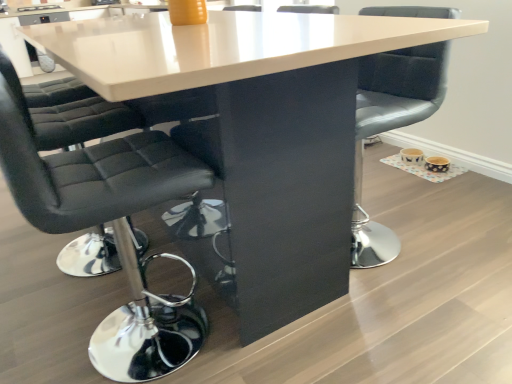
Image resolution: width=512 pixels, height=384 pixels. What do you see at coordinates (391, 127) in the screenshot?
I see `matte gray cushioned chair at center, placed as the second chair when sorted from left to right` at bounding box center [391, 127].

Locate an element on the screen. Image resolution: width=512 pixels, height=384 pixels. matte gray cushioned chair at center, placed as the second chair when sorted from left to right is located at coordinates (391, 127).

You are a GUI agent. You are given a task and a screenshot of the screen. Output one action in this format:
    pyautogui.click(x=<x>, y=<y>)
    Task: Click on the black leather chair at left, the first chair when ordered from left to right
    
    Given the screenshot: What is the action you would take?
    pyautogui.click(x=113, y=227)

This screenshot has width=512, height=384. What do you see at coordinates (113, 227) in the screenshot?
I see `black leather chair at left, positioned as the 2th chair in right-to-left order` at bounding box center [113, 227].

Image resolution: width=512 pixels, height=384 pixels. What are the coordinates of `matte gray cushioned chair at center, placed as the second chair when sorted from left to right` in the screenshot? It's located at (391, 127).

Which is more to the left, black leather chair at left, the first chair when ordered from left to right, or matte gray cushioned chair at center, which appears as the 1th chair when viewed from the right?

Positioned to the left is black leather chair at left, the first chair when ordered from left to right.

Is the depth of black leather chair at left, the first chair when ordered from left to right, greater than that of matte gray cushioned chair at center, which appears as the 1th chair when viewed from the right?

No.

Which is nearer, (183, 347) or (421, 59)?

Clearly, point (183, 347) is closer to the camera than point (421, 59).

From the image's perspective, between black leather chair at left, the first chair when ordered from left to right, and matte gray cushioned chair at center, placed as the second chair when sorted from left to right, who is located below?

black leather chair at left, the first chair when ordered from left to right.

From a real-world perspective, which object stands above the other?

From a 3D spatial view, black leather chair at left, positioned as the 2th chair in right-to-left order, is above.

In terms of width, does black leather chair at left, the first chair when ordered from left to right, look wider or thinner when compared to matte gray cushioned chair at center, placed as the second chair when sorted from left to right?

Clearly, black leather chair at left, the first chair when ordered from left to right, has more width compared to matte gray cushioned chair at center, placed as the second chair when sorted from left to right.

Considering the sizes of black leather chair at left, positioned as the 2th chair in right-to-left order, and matte gray cushioned chair at center, placed as the second chair when sorted from left to right, in the image, is black leather chair at left, positioned as the 2th chair in right-to-left order, taller or shorter than matte gray cushioned chair at center, placed as the second chair when sorted from left to right,?

black leather chair at left, positioned as the 2th chair in right-to-left order, is taller than matte gray cushioned chair at center, placed as the second chair when sorted from left to right.

Based on their sizes in the image, would you say black leather chair at left, positioned as the 2th chair in right-to-left order, is bigger or smaller than matte gray cushioned chair at center, which appears as the 1th chair when viewed from the right?

black leather chair at left, positioned as the 2th chair in right-to-left order, is bigger than matte gray cushioned chair at center, which appears as the 1th chair when viewed from the right.

Would you say black leather chair at left, the first chair when ordered from left to right, contains matte gray cushioned chair at center, placed as the second chair when sorted from left to right?

No, matte gray cushioned chair at center, placed as the second chair when sorted from left to right, is not a part of black leather chair at left, the first chair when ordered from left to right.

Would you say black leather chair at left, positioned as the 2th chair in right-to-left order, is a long distance from matte gray cushioned chair at center, placed as the second chair when sorted from left to right?

No, black leather chair at left, positioned as the 2th chair in right-to-left order, is in close proximity to matte gray cushioned chair at center, placed as the second chair when sorted from left to right.

Is black leather chair at left, the first chair when ordered from left to right, oriented away from matte gray cushioned chair at center, which appears as the 1th chair when viewed from the right?

black leather chair at left, the first chair when ordered from left to right, does not have its back to matte gray cushioned chair at center, which appears as the 1th chair when viewed from the right.

How much distance is there between black leather chair at left, the first chair when ordered from left to right, and matte gray cushioned chair at center, which appears as the 1th chair when viewed from the right?

black leather chair at left, the first chair when ordered from left to right, is 30.98 inches from matte gray cushioned chair at center, which appears as the 1th chair when viewed from the right.

Find the location of a particular element. chair that appears below the matte gray cushioned chair at center, which appears as the 1th chair when viewed from the right (from the image's perspective) is located at coordinates (113, 227).

Considering the relative positions of matte gray cushioned chair at center, placed as the second chair when sorted from left to right, and black leather chair at left, positioned as the 2th chair in right-to-left order, in the image provided, is matte gray cushioned chair at center, placed as the second chair when sorted from left to right, to the right of black leather chair at left, positioned as the 2th chair in right-to-left order, from the viewer's perspective?

Correct, you'll find matte gray cushioned chair at center, placed as the second chair when sorted from left to right, to the right of black leather chair at left, positioned as the 2th chair in right-to-left order.

Which object is further away from the camera, matte gray cushioned chair at center, which appears as the 1th chair when viewed from the right, or black leather chair at left, positioned as the 2th chair in right-to-left order?

matte gray cushioned chair at center, which appears as the 1th chair when viewed from the right, is behind.

Is point (366, 247) farther from camera compared to point (28, 197)?

Yes.

From the image's perspective, is matte gray cushioned chair at center, placed as the second chair when sorted from left to right, on black leather chair at left, positioned as the 2th chair in right-to-left order?

Yes, from the image's perspective, matte gray cushioned chair at center, placed as the second chair when sorted from left to right, is above black leather chair at left, positioned as the 2th chair in right-to-left order.

From a real-world perspective, which is physically above, matte gray cushioned chair at center, placed as the second chair when sorted from left to right, or black leather chair at left, positioned as the 2th chair in right-to-left order?

black leather chair at left, positioned as the 2th chair in right-to-left order.

Between matte gray cushioned chair at center, placed as the second chair when sorted from left to right, and black leather chair at left, positioned as the 2th chair in right-to-left order, which one has larger width?

black leather chair at left, positioned as the 2th chair in right-to-left order, is wider.

In terms of height, does matte gray cushioned chair at center, which appears as the 1th chair when viewed from the right, look taller or shorter compared to black leather chair at left, the first chair when ordered from left to right?

In the image, matte gray cushioned chair at center, which appears as the 1th chair when viewed from the right, appears to be shorter than black leather chair at left, the first chair when ordered from left to right.

Between matte gray cushioned chair at center, placed as the second chair when sorted from left to right, and black leather chair at left, the first chair when ordered from left to right, which one has smaller size?

matte gray cushioned chair at center, placed as the second chair when sorted from left to right.

Would you say matte gray cushioned chair at center, placed as the second chair when sorted from left to right, is outside black leather chair at left, the first chair when ordered from left to right?

Yes, matte gray cushioned chair at center, placed as the second chair when sorted from left to right, is not within black leather chair at left, the first chair when ordered from left to right.

Is matte gray cushioned chair at center, placed as the second chair when sorted from left to right, next to black leather chair at left, the first chair when ordered from left to right, and touching it?

No, matte gray cushioned chair at center, placed as the second chair when sorted from left to right, is not in contact with black leather chair at left, the first chair when ordered from left to right.

Is matte gray cushioned chair at center, which appears as the 1th chair when viewed from the right, facing towards black leather chair at left, the first chair when ordered from left to right?

Yes, matte gray cushioned chair at center, which appears as the 1th chair when viewed from the right, is aimed at black leather chair at left, the first chair when ordered from left to right.

You are a GUI agent. You are given a task and a screenshot of the screen. Output one action in this format:
    pyautogui.click(x=<x>, y=<y>)
    Task: Click on the chair to the right of black leather chair at left, the first chair when ordered from left to right
    The height and width of the screenshot is (384, 512).
    Given the screenshot: What is the action you would take?
    pyautogui.click(x=391, y=127)

Identify the location of chair that appears in front of the matte gray cushioned chair at center, which appears as the 1th chair when viewed from the right. This screenshot has height=384, width=512. (113, 227).

Image resolution: width=512 pixels, height=384 pixels. Identify the location of chair below the black leather chair at left, the first chair when ordered from left to right (from a real-world perspective). (391, 127).